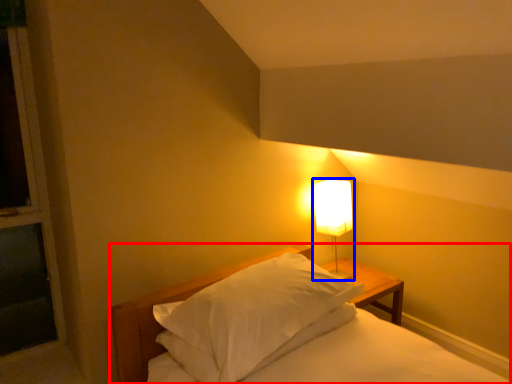
Question: Which point is further to the camera, bed (highlighted by a red box) or lamp (highlighted by a blue box)?

Choices:
 (A) bed
 (B) lamp

Answer: (B)